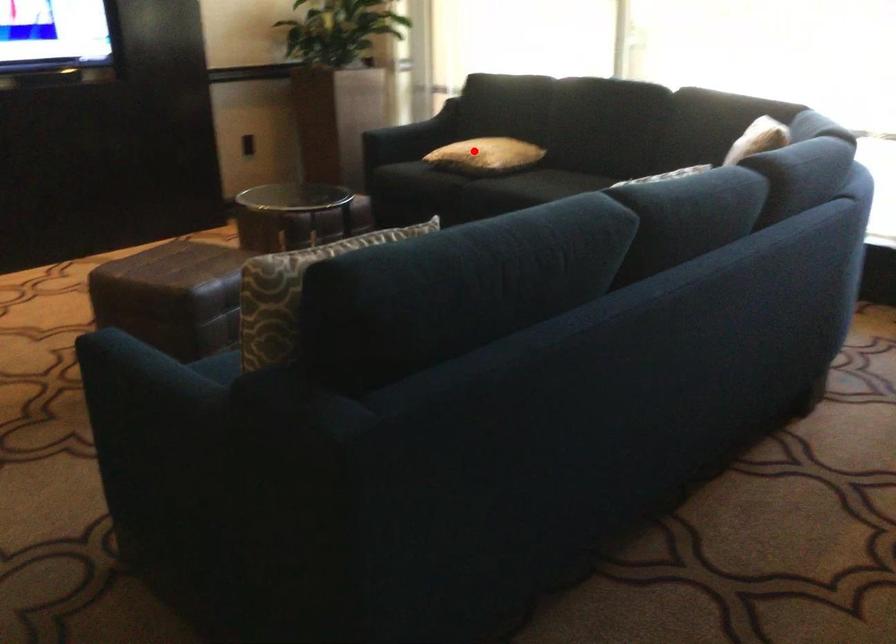
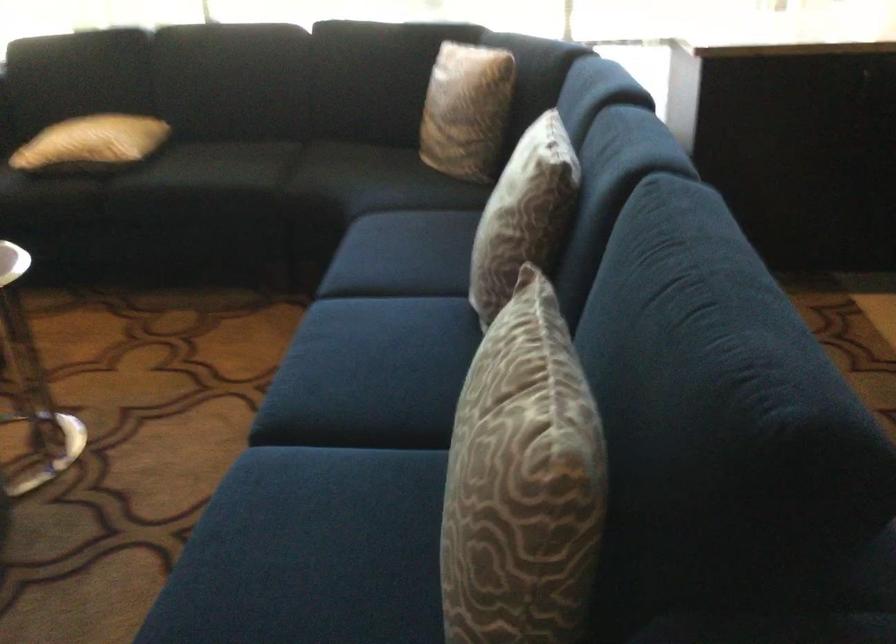
Question: I am providing you with two images of the same scene from different viewpoints. Given a red point in image1, look at the same physical point in image2. Is it:

Choices:
 (A) Closer to the viewpoint
 (B) Farther from the viewpoint

Answer: (A)